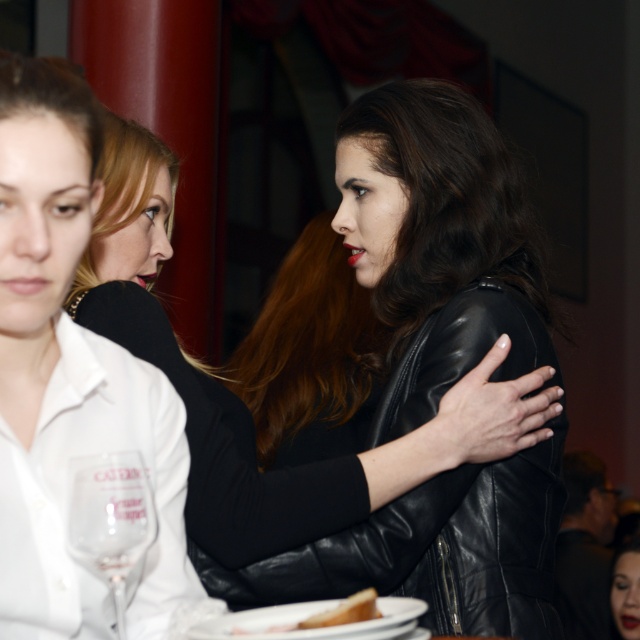
Question: Observing the image, what is the correct spatial positioning of matte black jacket at upper center in reference to black leather jacket at center?

Choices:
 (A) right
 (B) left

Answer: (B)

Question: Among these objects, which one is nearest to the camera?

Choices:
 (A) white bread at lower center
 (B) transparent glass at lower left
 (C) matte black jacket at upper center

Answer: (B)

Question: Considering the real-world distances, which object is closest to the white bread at lower center?

Choices:
 (A) matte black jacket at upper center
 (B) black leather jacket at center
 (C) transparent glass at lower left

Answer: (C)

Question: Estimate the real-world distances between objects in this image. Which object is farther from the white bread at lower center?

Choices:
 (A) transparent glass at lower left
 (B) black leather jacket at center
 (C) matte black jacket at upper center

Answer: (B)

Question: Where is matte black jacket at upper center located in relation to black leather jacket at center in the image?

Choices:
 (A) left
 (B) right

Answer: (A)

Question: Does black leather jacket at center appear on the left side of transparent glass at lower left?

Choices:
 (A) no
 (B) yes

Answer: (A)